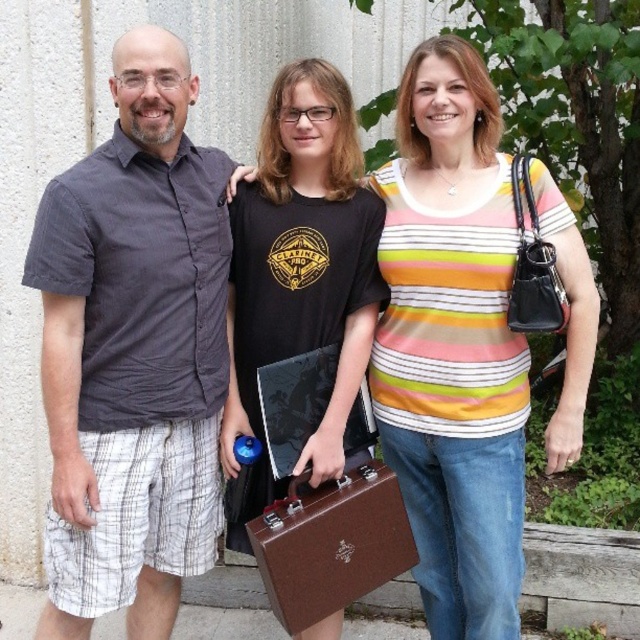
Measure the distance from black matte t-shirt at center to brown leather briefcase at center.

black matte t-shirt at center is 40.91 centimeters from brown leather briefcase at center.

Where is `black matte t-shirt at center`? The height and width of the screenshot is (640, 640). black matte t-shirt at center is located at coordinates (301, 257).

Does gray cotton shirt at center lie in front of brown leather briefcase at center?

Yes, it is in front of brown leather briefcase at center.

Can you confirm if gray cotton shirt at center is smaller than brown leather briefcase at center?

No.

At what (x,y) coordinates should I click in order to perform the action: click on gray cotton shirt at center. Please return your answer as a coordinate pair (x, y). The width and height of the screenshot is (640, 640). Looking at the image, I should click on (132, 353).

Is point (68, 492) closer to camera compared to point (429, 316)?

Yes, point (68, 492) is closer to viewer.

This screenshot has width=640, height=640. Describe the element at coordinates (132, 353) in the screenshot. I see `gray cotton shirt at center` at that location.

Identify the location of gray cotton shirt at center. (132, 353).